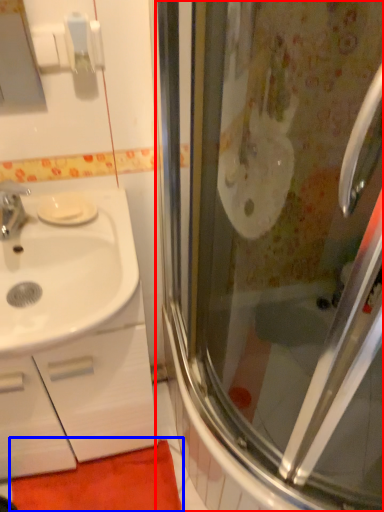
Question: Which of the following is the closest to the observer, screen door (highlighted by a red box) or bath mat (highlighted by a blue box)?

Choices:
 (A) screen door
 (B) bath mat

Answer: (A)